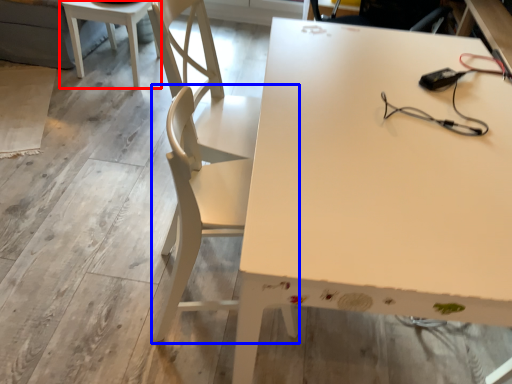
Question: Which object appears closest to the camera in this image, table (highlighted by a red box) or chair (highlighted by a blue box)?

Choices:
 (A) table
 (B) chair

Answer: (B)